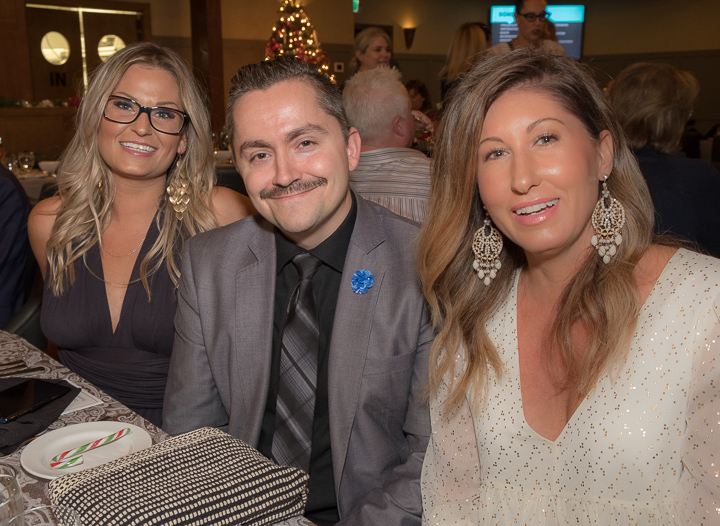
Locate an element on the screen. wall light is located at coordinates click(x=408, y=32).